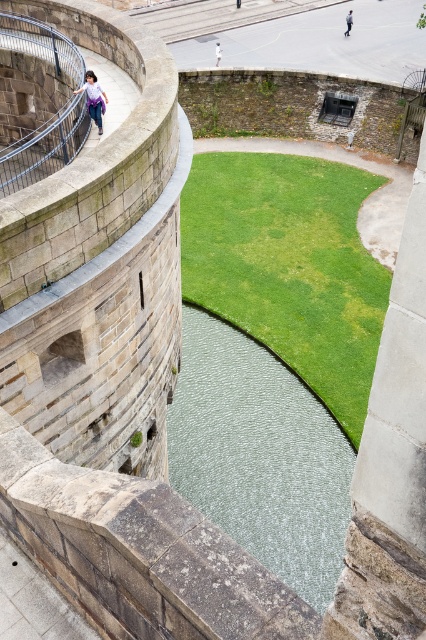
Question: Is denim pants at upper left thinner than light blue jeans at center?

Choices:
 (A) no
 (B) yes

Answer: (B)

Question: Does light blue jeans at center appear on the left side of white cotton shirt at upper left?

Choices:
 (A) no
 (B) yes

Answer: (A)

Question: Considering the real-world distances, which object is farthest from the rustic metal balustrade at upper left?

Choices:
 (A) light blue jeans at center
 (B) white cotton shirt at upper left

Answer: (A)

Question: Which object is farther from the camera taking this photo?

Choices:
 (A) light blue jeans at center
 (B) rustic metal balustrade at upper left
 (C) green grass at center
 (D) white cotton shirt at upper left

Answer: (A)

Question: Which object is closer to the camera taking this photo?

Choices:
 (A) light blue jeans at center
 (B) denim pants at upper left
 (C) rustic metal balustrade at upper left
 (D) green grass at center

Answer: (C)

Question: Does green grass at center have a greater width compared to white cotton shirt at upper left?

Choices:
 (A) no
 (B) yes

Answer: (B)